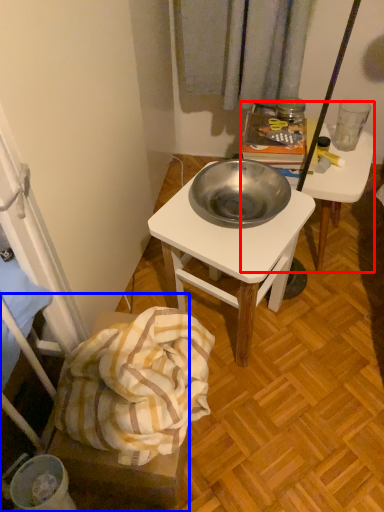
Question: Which point is closer to the camera, desk (highlighted by a red box) or furniture (highlighted by a blue box)?

Choices:
 (A) desk
 (B) furniture

Answer: (B)